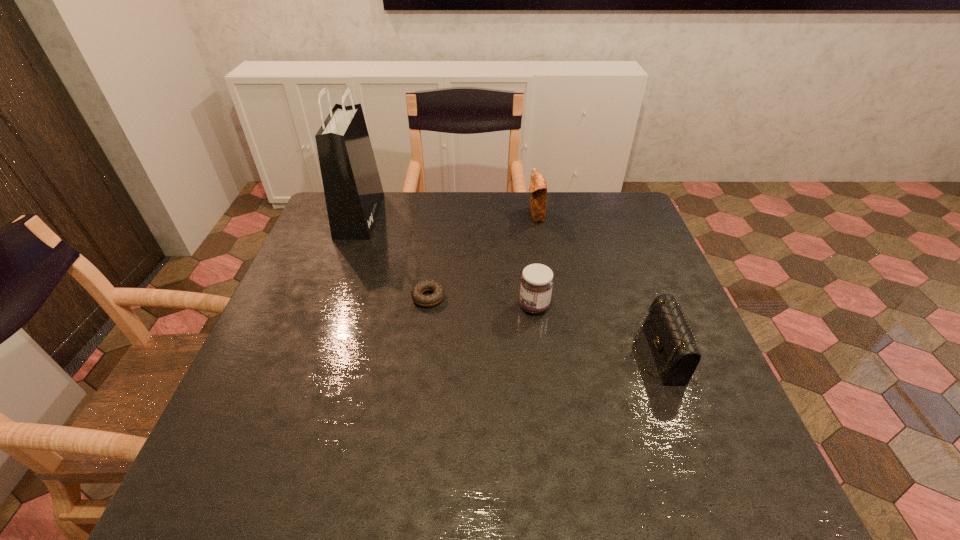
Locate an element on the screen. free space between the shopping bag and the jam is located at coordinates (447, 261).

Find the location of a particular element. empty location between the doughnut and the shorter clutch bag is located at coordinates (543, 326).

Locate an element on the screen. blank region between the rightmost object and the shopping bag is located at coordinates (509, 285).

This screenshot has width=960, height=540. What are the coordinates of `vacant area between the doughnut and the jam` in the screenshot? It's located at (481, 302).

I want to click on vacant area that lies between the left clutch bag and the shopping bag, so click(447, 215).

Where is `free space between the doughnut and the shopping bag`? The height and width of the screenshot is (540, 960). free space between the doughnut and the shopping bag is located at coordinates (394, 256).

Where is `unoccupied area between the taller clutch bag and the shortest object`? unoccupied area between the taller clutch bag and the shortest object is located at coordinates (482, 256).

At what (x,y) coordinates should I click in order to perform the action: click on free space between the doughnut and the shopping bag. Please return your answer as a coordinate pair (x, y). Looking at the image, I should click on (394, 256).

Locate an element on the screen. free spot between the jam and the shortest object is located at coordinates (481, 302).

This screenshot has height=540, width=960. Identify the location of empty space between the taller clutch bag and the leftmost object. (447, 215).